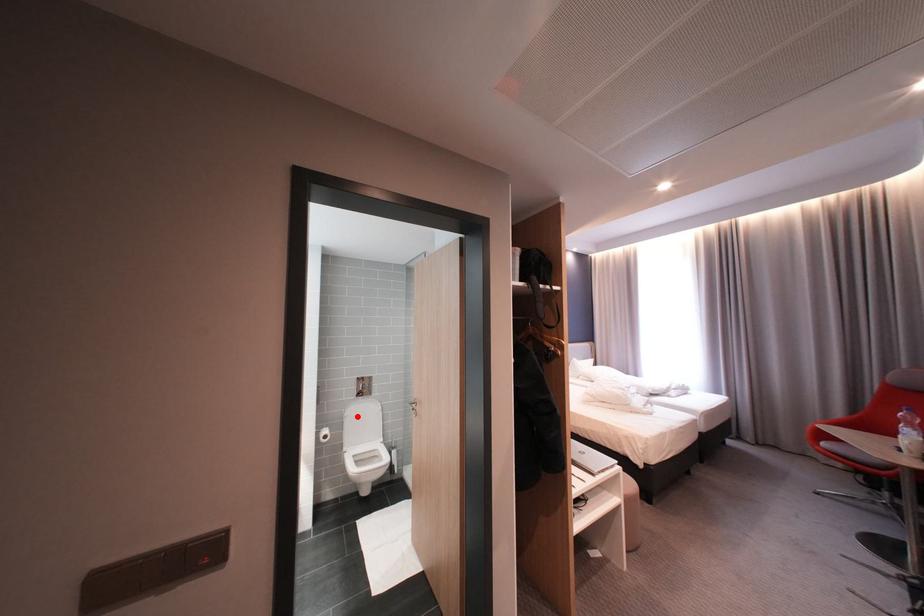
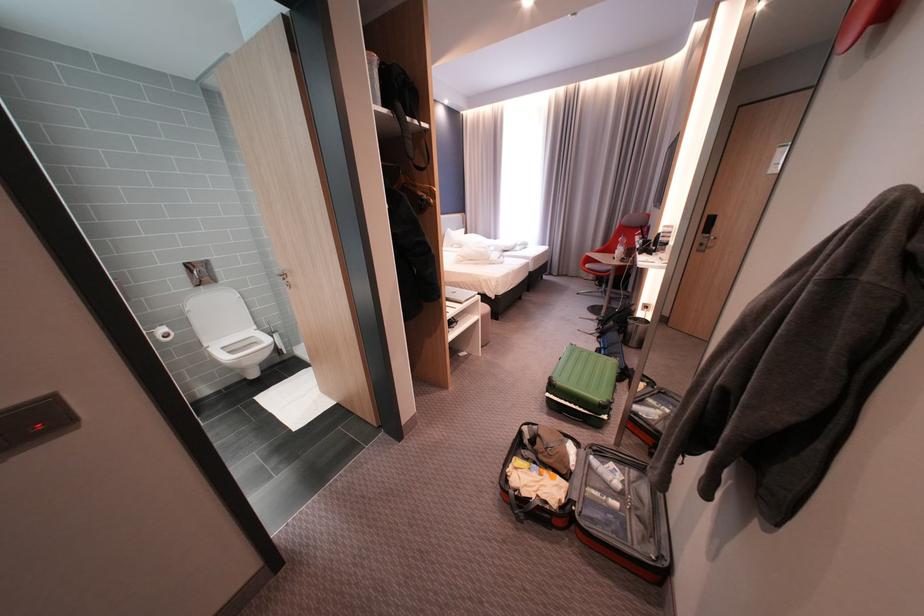
Where in the second image is the point corresponding to the highlighted location from the first image?

(201, 312)